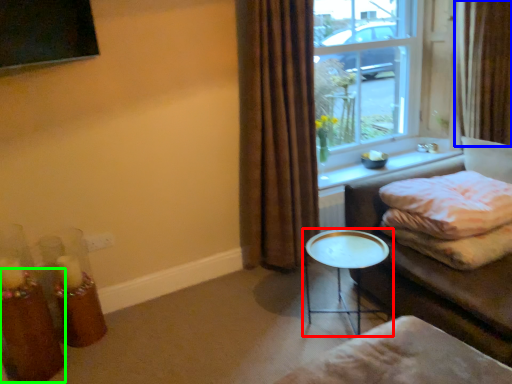
Question: Based on their relative distances, which object is nearer to table (highlighted by a red box)? Choose from curtain (highlighted by a blue box) and candle holder (highlighted by a green box).

Choices:
 (A) curtain
 (B) candle holder

Answer: (B)